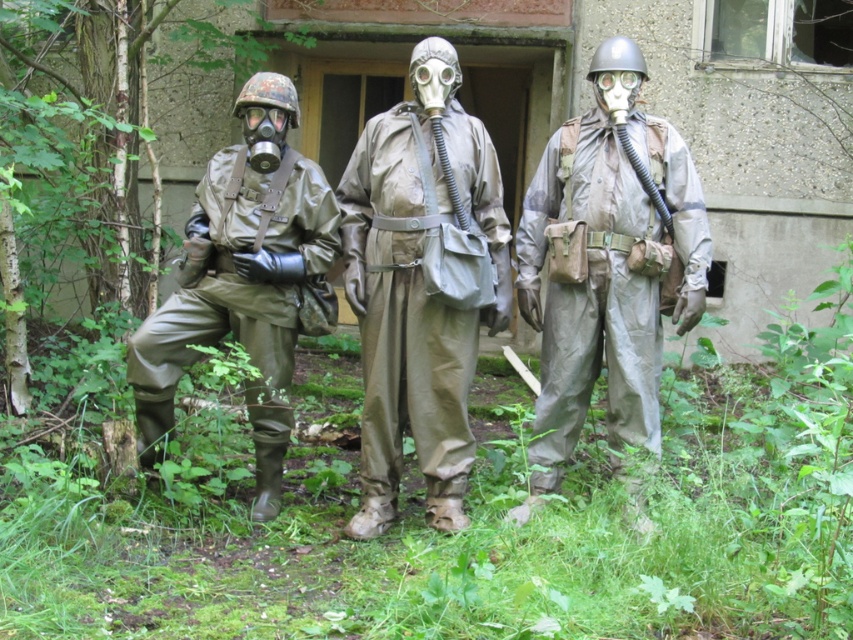
Between camouflage fabric suit at center and matte green rubber suit at left, which one is positioned lower?

Positioned lower is matte green rubber suit at left.

Does camouflage fabric suit at center appear on the left side of matte green rubber suit at left?

Incorrect, camouflage fabric suit at center is not on the left side of matte green rubber suit at left.

Describe the element at coordinates (607, 264) in the screenshot. I see `camouflage fabric suit at center` at that location.

Find the location of `camouflage fabric suit at center`. camouflage fabric suit at center is located at coordinates (607, 264).

Is the position of matte khaki gas mask at center more distant than that of matte green rubber suit at left?

No, matte khaki gas mask at center is in front of matte green rubber suit at left.

Between point (398, 204) and point (277, 458), which one is positioned behind?

Point (277, 458)

You are a GUI agent. You are given a task and a screenshot of the screen. Output one action in this format:
    pyautogui.click(x=<x>, y=<y>)
    Task: Click on the matte khaki gas mask at center
    The image size is (853, 640).
    Given the screenshot: What is the action you would take?
    pyautogui.click(x=422, y=285)

Does matte khaki gas mask at center have a greater height compared to camouflage fabric suit at center?

Yes.

Which of these two, matte khaki gas mask at center or camouflage fabric suit at center, stands shorter?

camouflage fabric suit at center

Is point (369, 241) behind point (579, 301)?

Yes, point (369, 241) is behind point (579, 301).

Find the location of a particular element. Image resolution: width=853 pixels, height=640 pixels. matte khaki gas mask at center is located at coordinates (422, 285).